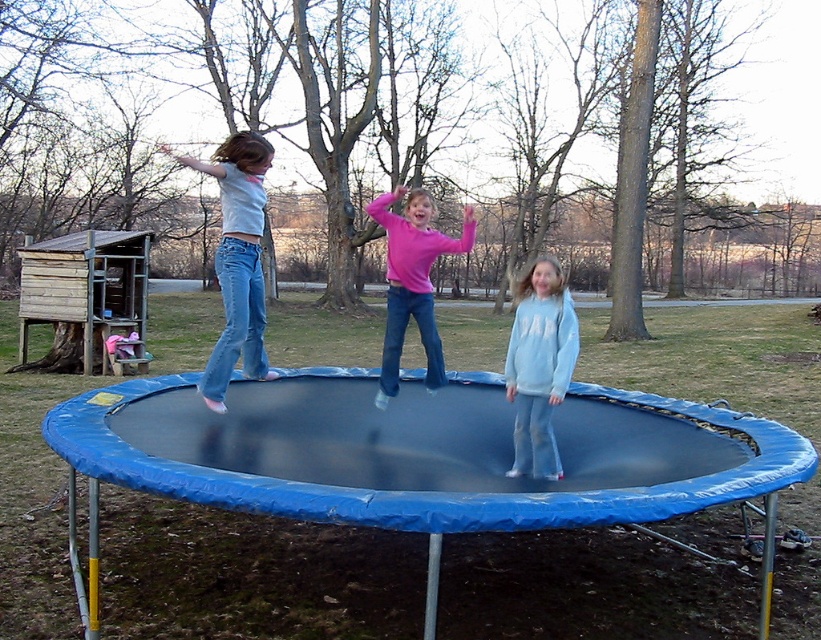
You are a parent trying to ensure your child can safely jump on the blue rubber trampoline at center while wearing light blue denim jeans at left. Considering the height difference between the two, is there a risk of the jeans getting caught in the trampoline?

The blue rubber trampoline at center is taller than the light blue denim jeans at left, so there is no risk of the jeans getting caught in the trampoline.

You are a photographer standing at the edge of the trampoline. You want to take a photo of the light blue denim jeans at left and the blue rubber trampoline at center. Which object should you focus on first if you want to capture both in the same frame?

The blue rubber trampoline at center is located below light blue denim jeans at left, so you should focus on the light blue denim jeans at left first to ensure both are in the frame.

Based on the photo, you are a parent trying to ensure your child stays safe while playing on the blue rubber trampoline at center. You notice the light blue fleece sweatshirt at center nearby. Can the sweatshirt be placed entirely on the trampoline without any part hanging off?

The blue rubber trampoline at center is wider than the light blue fleece sweatshirt at center, so yes, the sweatshirt can be placed entirely on the trampoline without any part hanging off.